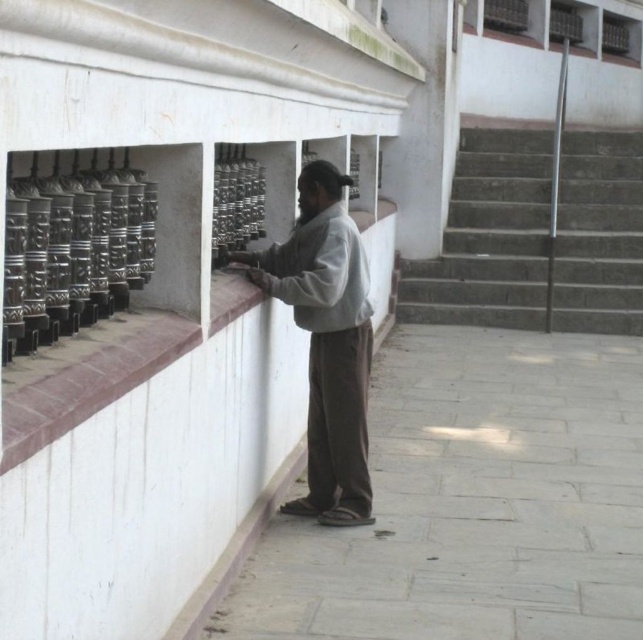
Is concrete stairs at right wider than gray cotton shirt at center?

Yes.

Does concrete stairs at right appear under gray cotton shirt at center?

Actually, concrete stairs at right is above gray cotton shirt at center.

Locate an element on the screen. The image size is (643, 640). concrete stairs at right is located at coordinates (487, 236).